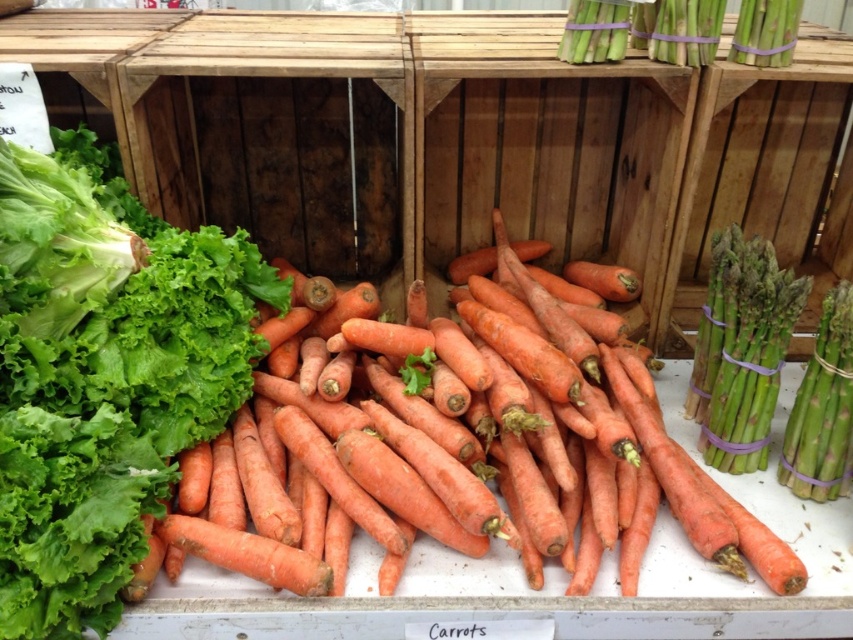
Question: Which object is closer to the camera taking this photo?

Choices:
 (A) orange matte carrots at left
 (B) orange matte carrots at center
 (C) green matte asparagus at upper right

Answer: (A)

Question: Which point is farther to the camera?

Choices:
 (A) orange matte carrots at left
 (B) orange matte carrots at center
 (C) green matte asparagus at upper right

Answer: (C)

Question: Does orange matte carrots at center appear on the right side of green matte asparagus at upper right?

Choices:
 (A) yes
 (B) no

Answer: (B)

Question: Observing the image, what is the correct spatial positioning of orange matte carrots at center in reference to green matte asparagus at upper right?

Choices:
 (A) right
 (B) left

Answer: (B)

Question: Based on their relative distances, which object is farther from the green matte asparagus at upper right?

Choices:
 (A) orange matte carrots at left
 (B) orange matte carrots at center

Answer: (A)

Question: Does orange matte carrots at left have a lesser width compared to green matte asparagus at upper right?

Choices:
 (A) no
 (B) yes

Answer: (B)